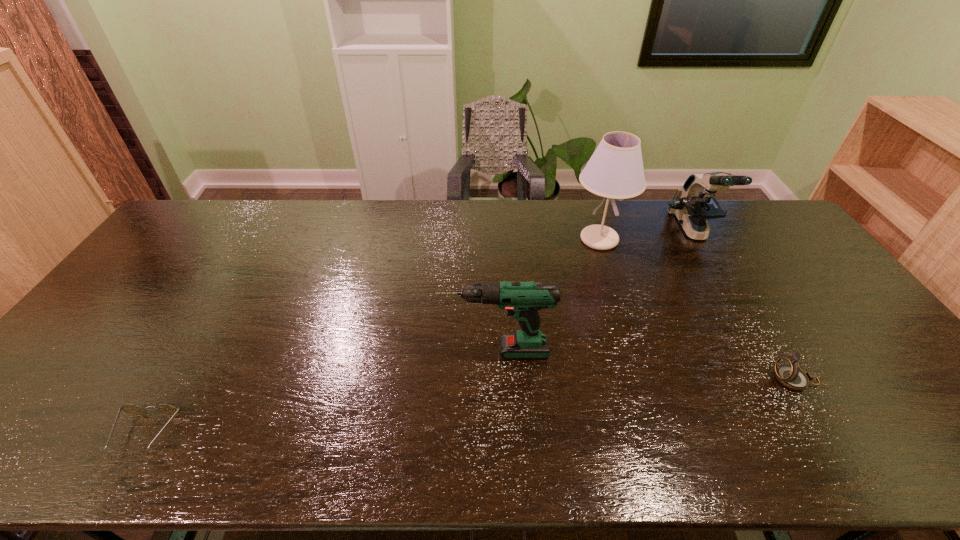
The width and height of the screenshot is (960, 540). Identify the location of vacant area that lies between the fourth tallest object and the lampshade. (697, 309).

The height and width of the screenshot is (540, 960). Find the location of `free space that is in between the fourth tallest object and the second object from left to right`. free space that is in between the fourth tallest object and the second object from left to right is located at coordinates (645, 366).

Where is `free space between the fourth tallest object and the microscope`? Image resolution: width=960 pixels, height=540 pixels. free space between the fourth tallest object and the microscope is located at coordinates (744, 306).

This screenshot has width=960, height=540. I want to click on vacant area that lies between the microscope and the tallest object, so click(x=646, y=235).

Identify which object is the fourth closest to the lampshade. Please provide its 2D coordinates. Your answer should be formatted as a tuple, i.e. [(x, y)], where the tuple contains the x and y coordinates of a point satisfying the conditions above.

[(132, 409)]

Identify which object is the second closest to the shortest object. Please provide its 2D coordinates. Your answer should be formatted as a tuple, i.e. [(x, y)], where the tuple contains the x and y coordinates of a point satisfying the conditions above.

[(615, 170)]

I want to click on blank area in the image that satisfies the following two spatial constraints: 1. on the face of the fourth farthest object; 2. on the front-facing side of the shortest object, so click(828, 434).

Where is `blank space that satisfies the following two spatial constraints: 1. through the eyepieces of the microscope; 2. on the handle side of the drill`? This screenshot has height=540, width=960. blank space that satisfies the following two spatial constraints: 1. through the eyepieces of the microscope; 2. on the handle side of the drill is located at coordinates (763, 352).

Where is `vacant space that satisfies the following two spatial constraints: 1. on the handle side of the second object from left to right; 2. on the front-facing side of the nearest object`? vacant space that satisfies the following two spatial constraints: 1. on the handle side of the second object from left to right; 2. on the front-facing side of the nearest object is located at coordinates (498, 434).